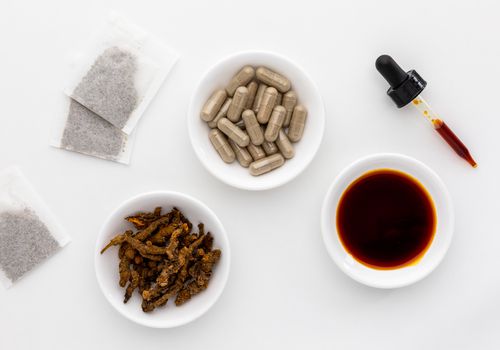
The width and height of the screenshot is (500, 350). Find the location of `small white ceramic bowl`. small white ceramic bowl is located at coordinates (393, 219), (170, 254), (268, 113).